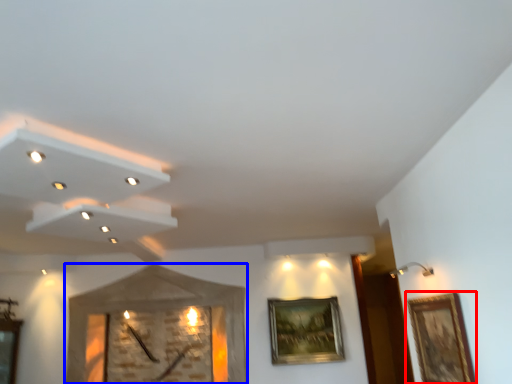
Question: Which of the following is the closest to the observer, picture frame (highlighted by a red box) or clock (highlighted by a blue box)?

Choices:
 (A) picture frame
 (B) clock

Answer: (A)